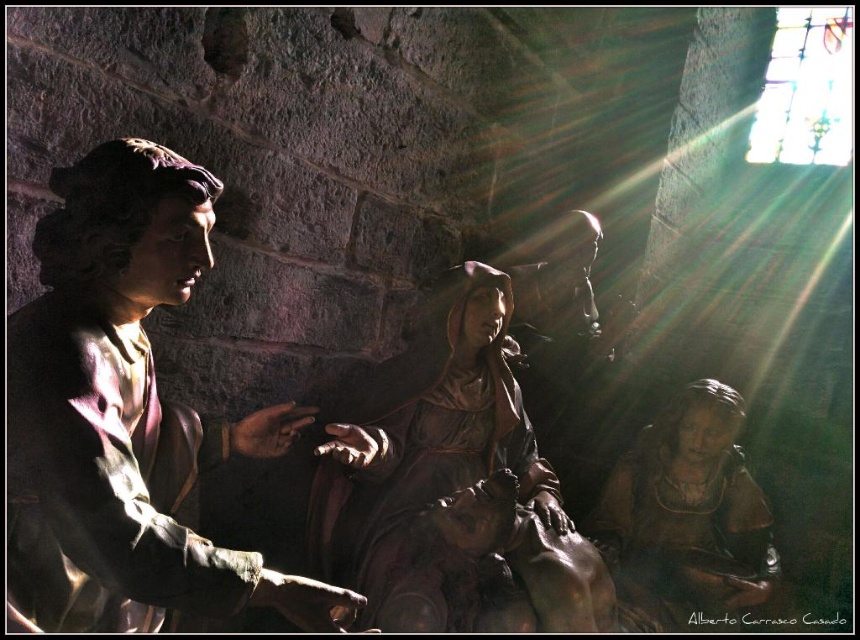
Does matte bronze statue at left have a lesser height compared to brown matte statue at lower right?

No.

Who is lower down, matte bronze statue at left or brown matte statue at lower right?

brown matte statue at lower right is lower down.

Describe the element at coordinates (126, 416) in the screenshot. I see `matte bronze statue at left` at that location.

Identify the location of matte bronze statue at left. (126, 416).

Is brown polished wood statue at center smaller than brown matte statue at lower right?

No, brown polished wood statue at center is not smaller than brown matte statue at lower right.

Describe the element at coordinates (452, 486) in the screenshot. I see `brown polished wood statue at center` at that location.

This screenshot has height=640, width=860. I want to click on brown polished wood statue at center, so click(x=452, y=486).

Where is `brown polished wood statue at center`? The image size is (860, 640). brown polished wood statue at center is located at coordinates (452, 486).

Is matte bronze statue at left taller than brown polished wood statue at center?

No, matte bronze statue at left is not taller than brown polished wood statue at center.

Is point (112, 582) behind point (435, 301)?

That is False.

Where is `matte bronze statue at left`? matte bronze statue at left is located at coordinates (126, 416).